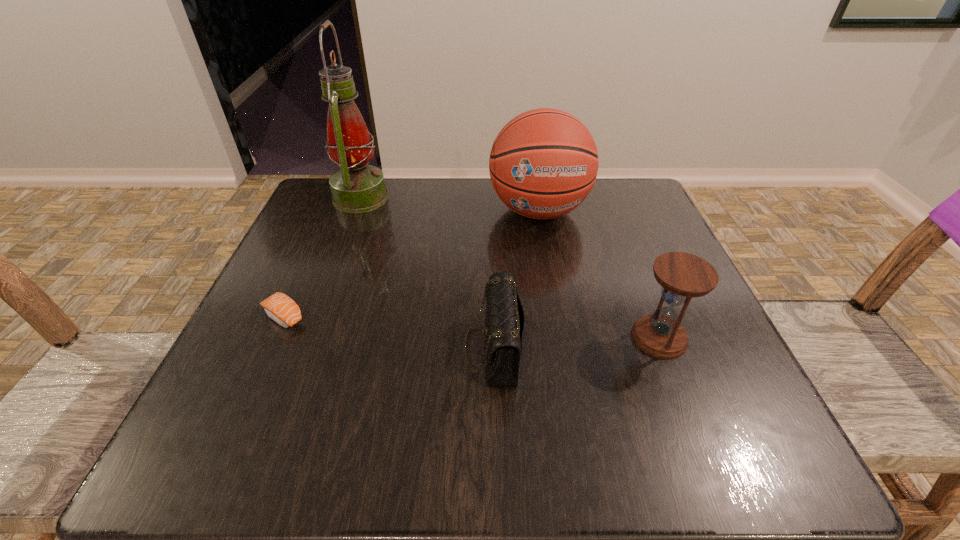
In order to click on vacant space located 0.190m on the front flap of the clutch bag in this screenshot , I will do `click(347, 348)`.

Image resolution: width=960 pixels, height=540 pixels. Find the location of `vacant space situated on the front flap of the clutch bag`. vacant space situated on the front flap of the clutch bag is located at coordinates (421, 348).

In order to click on vacant space located on the back of the shortest object in this screenshot , I will do `click(330, 212)`.

The image size is (960, 540). Identify the location of oil lamp that is at the far edge. pos(357,187).

Find the location of a particular element. basketball present at the far edge is located at coordinates (x=543, y=163).

Locate an element on the screen. oil lamp at the left edge is located at coordinates (357, 187).

The height and width of the screenshot is (540, 960). Identify the location of sushi at the left edge. (279, 307).

Image resolution: width=960 pixels, height=540 pixels. What are the coordinates of `basketball present at the right edge` in the screenshot? It's located at (543, 163).

What are the coordinates of `hourglass that is at the right edge` in the screenshot? It's located at (682, 276).

This screenshot has width=960, height=540. Identify the location of object that is at the far left corner. (357, 187).